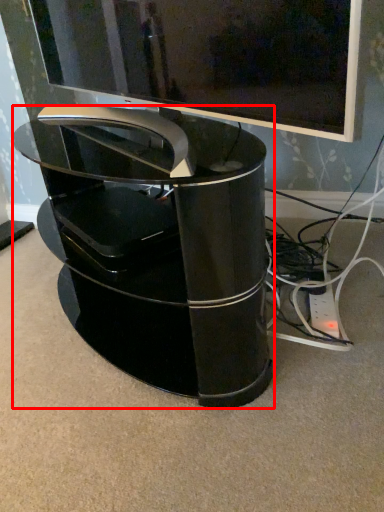
Question: From the image's perspective, where is furniture (annotated by the red box) located in relation to television in the image?

Choices:
 (A) above
 (B) below

Answer: (B)